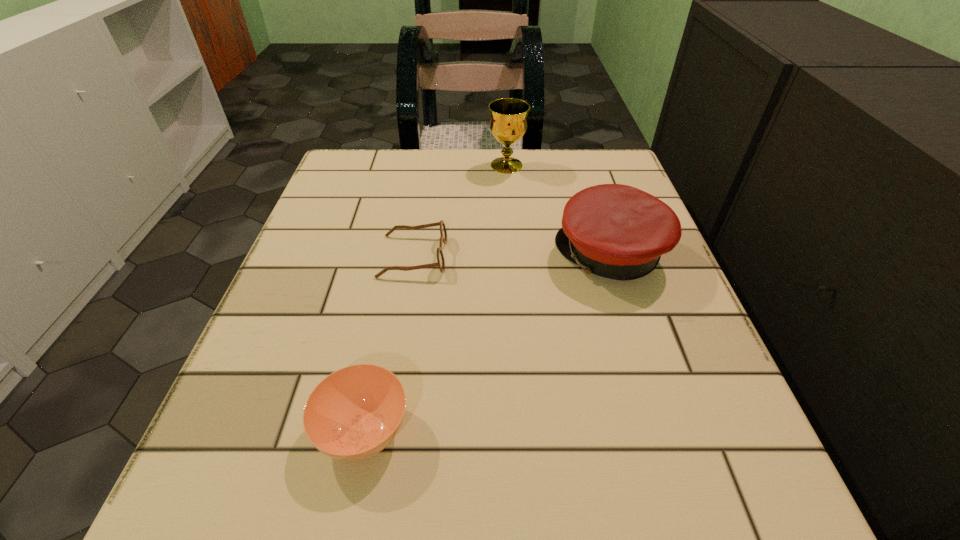
You are a GUI agent. You are given a task and a screenshot of the screen. Output one action in this format:
    pyautogui.click(x=<x>, y=<y>)
    Task: Click on the vacant region located at the front of the rightmost object where the visor is located
    
    Given the screenshot: What is the action you would take?
    pyautogui.click(x=341, y=255)

Identify the location of free space located 0.160m on the right of the soup bowl. (535, 430).

The height and width of the screenshot is (540, 960). Find the location of `free region located on the front-facing side of the spectacles`. free region located on the front-facing side of the spectacles is located at coordinates (614, 256).

Locate an element on the screen. The image size is (960, 540). object at the far edge is located at coordinates (508, 124).

Locate an element on the screen. object that is at the near edge is located at coordinates (354, 413).

The width and height of the screenshot is (960, 540). Find the location of `soup bowl that is at the left edge`. soup bowl that is at the left edge is located at coordinates (354, 413).

Identify the location of spectacles present at the left edge. The image size is (960, 540). [x=440, y=263].

Locate an element on the screen. The height and width of the screenshot is (540, 960). object that is at the right edge is located at coordinates (616, 231).

Identify the location of object present at the near left corner. The image size is (960, 540). (354, 413).

Find the location of `vacant region at the far edge`. vacant region at the far edge is located at coordinates (419, 195).